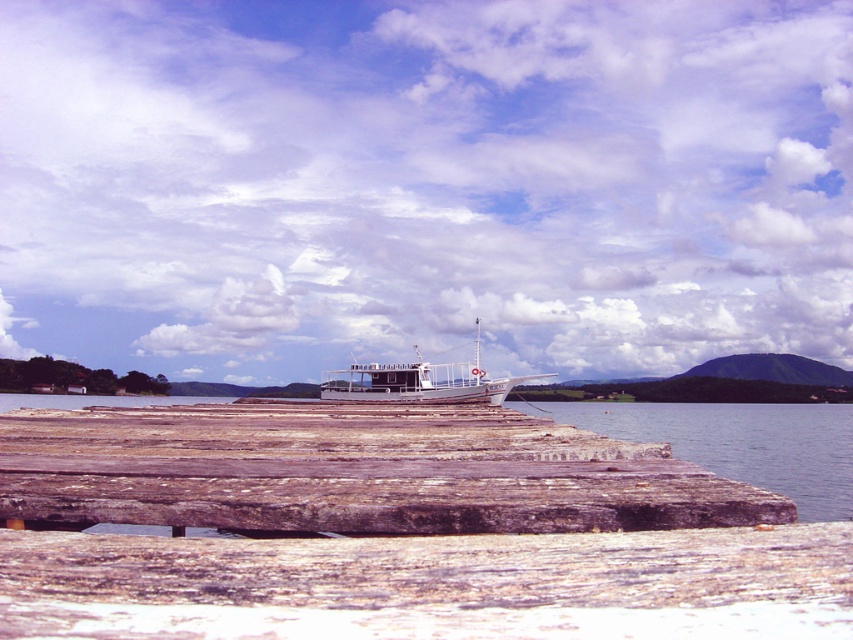
Question: Estimate the real-world distances between objects in this image. Which object is farther from the clear water at dock right?

Choices:
 (A) weathered wood dock at center
 (B) white wooden boat at center

Answer: (A)

Question: In this image, where is weathered wood dock at center located relative to white wooden boat at center?

Choices:
 (A) right
 (B) left

Answer: (B)

Question: Which point is closer to the camera?

Choices:
 (A) clear water at dock right
 (B) weathered wood dock at center
 (C) white wooden boat at center

Answer: (B)

Question: Can you confirm if weathered wood dock at center is thinner than white wooden boat at center?

Choices:
 (A) yes
 (B) no

Answer: (A)

Question: Estimate the real-world distances between objects in this image. Which object is farther from the weathered wood dock at center?

Choices:
 (A) white wooden boat at center
 (B) clear water at dock right

Answer: (A)

Question: Is clear water at dock right smaller than white wooden boat at center?

Choices:
 (A) no
 (B) yes

Answer: (A)